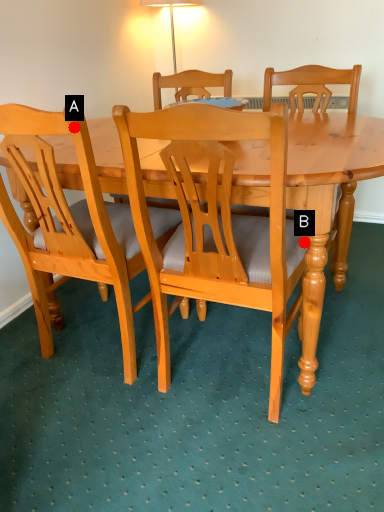
Question: Two points are circled on the image, labeled by A and B beside each circle. Which point is closer to the camera?

Choices:
 (A) A is closer
 (B) B is closer

Answer: (A)